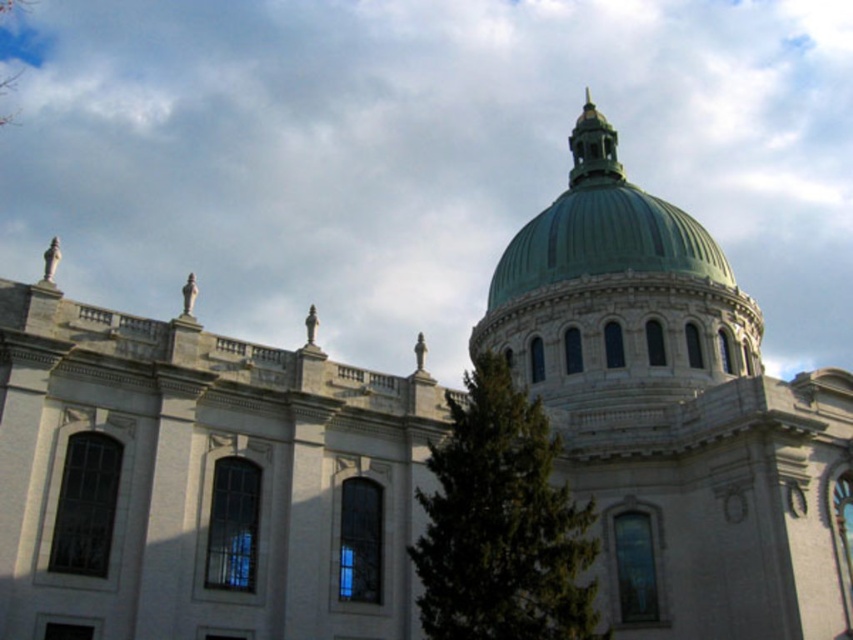
This screenshot has width=853, height=640. What do you see at coordinates (415, 154) in the screenshot?
I see `white fluffy cloud at upper center` at bounding box center [415, 154].

Is point (349, 232) closer to viewer compared to point (482, 612)?

No, (349, 232) is further to viewer.

Identify the location of white fluffy cloud at upper center. The image size is (853, 640). (415, 154).

Is point (584, 564) positioned after point (535, 284)?

No.

Can you confirm if green leafy tree at center is bigger than green polished dome at upper center?

Actually, green leafy tree at center might be smaller than green polished dome at upper center.

Between point (502, 560) and point (578, 170), which one is positioned in front?

Point (502, 560) is more forward.

What are the coordinates of `green leafy tree at center` in the screenshot? It's located at (502, 524).

Does white fluffy cloud at upper center appear over green polished dome at upper center?

No, white fluffy cloud at upper center is not above green polished dome at upper center.

Between white fluffy cloud at upper center and green polished dome at upper center, which one is positioned higher?

green polished dome at upper center

Is point (285, 243) closer to camera compared to point (505, 268)?

No, (285, 243) is further to viewer.

Find the location of `white fluffy cloud at upper center`. white fluffy cloud at upper center is located at coordinates pos(415,154).